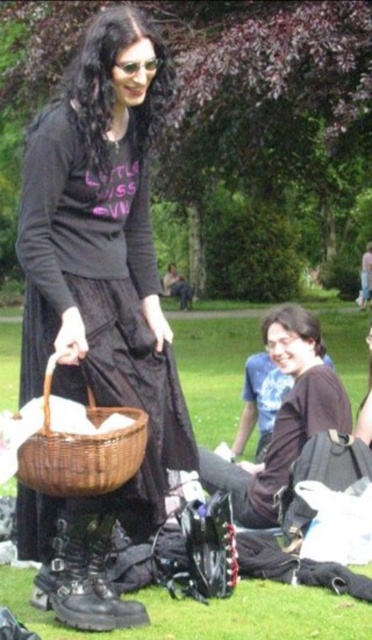
Is green grass at lower center thinner than black leather boot at lower center?

In fact, green grass at lower center might be wider than black leather boot at lower center.

Does green grass at lower center appear under black leather boot at lower center?

Incorrect, green grass at lower center is not positioned below black leather boot at lower center.

Between point (348, 320) and point (74, 589), which one is positioned in front?

Point (74, 589) is more forward.

You are a GUI agent. You are given a task and a screenshot of the screen. Output one action in this format:
    pyautogui.click(x=<x>, y=<y>)
    Task: Click on the green grass at lower center
    
    Given the screenshot: What is the action you would take?
    pyautogui.click(x=213, y=614)

Image resolution: width=372 pixels, height=640 pixels. What do you see at coordinates (97, 305) in the screenshot?
I see `matte black dress at center` at bounding box center [97, 305].

Looking at this image, is the position of matte black dress at center more distant than that of black leather boot at lower center?

That is False.

Which is behind, point (21, 240) or point (85, 538)?

Point (85, 538)

This screenshot has height=640, width=372. I want to click on matte black dress at center, so click(97, 305).

Measure the distance from matte black dress at center to woven brown basket at lower left.

matte black dress at center and woven brown basket at lower left are 14.80 inches apart from each other.

Consider the image. Does matte black dress at center have a smaller size compared to woven brown basket at lower left?

Incorrect, matte black dress at center is not smaller in size than woven brown basket at lower left.

Is point (26, 218) in front of point (114, 435)?

No, it is behind (114, 435).

This screenshot has height=640, width=372. In order to click on matte black dress at center in this screenshot , I will do `click(97, 305)`.